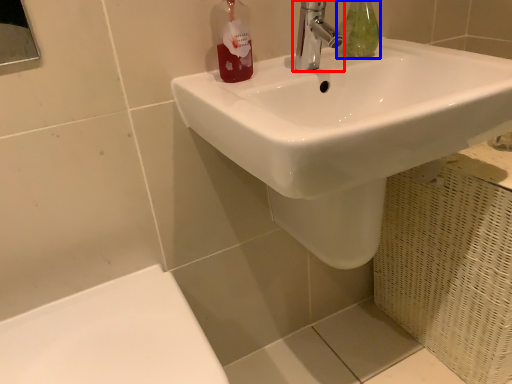
Question: Which point is further to the camera, tap (highlighted by a red box) or mouthwash (highlighted by a blue box)?

Choices:
 (A) tap
 (B) mouthwash

Answer: (B)